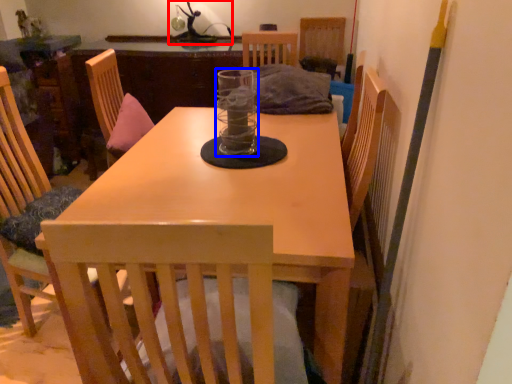
Question: Which of the following is the farthest to the observer, table lamp (highlighted by a red box) or glass jar (highlighted by a blue box)?

Choices:
 (A) table lamp
 (B) glass jar

Answer: (A)